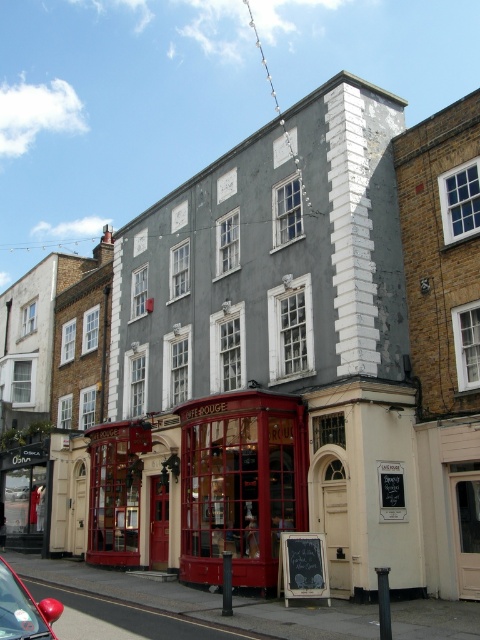
Who is taller, red glass storefront at center or shiny red car at lower left?

Standing taller between the two is red glass storefront at center.

Is point (259, 492) positioned after point (39, 618)?

Yes, it is behind point (39, 618).

Locate an element on the screen. The height and width of the screenshot is (640, 480). red glass storefront at center is located at coordinates (240, 483).